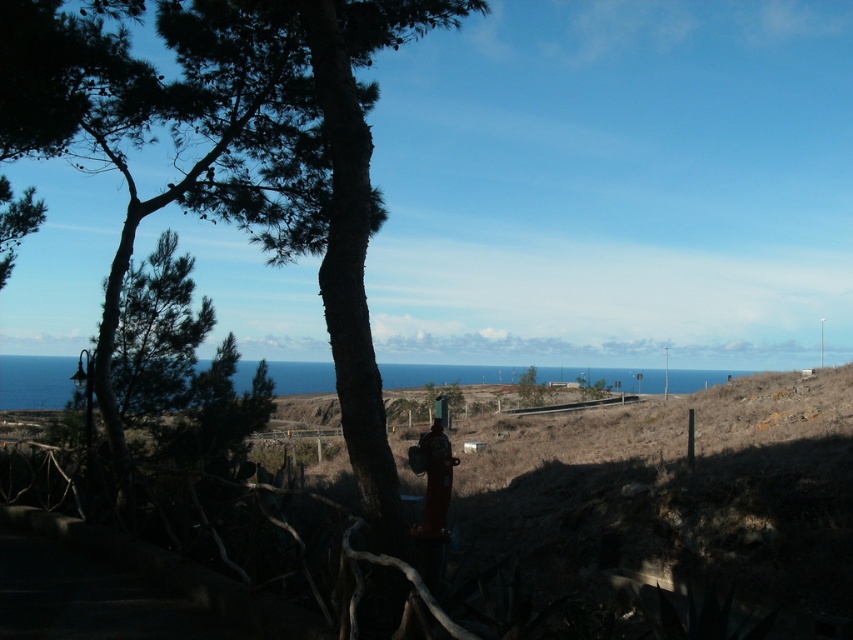
Can you confirm if matte brown jacket at center is taller than green leafy tree at center?

Yes, matte brown jacket at center is taller than green leafy tree at center.

Is matte brown jacket at center bigger than green leafy tree at center?

Yes, matte brown jacket at center is bigger than green leafy tree at center.

Is point (434, 456) positioned after point (537, 401)?

No, it is not.

Where is `matte brown jacket at center`? matte brown jacket at center is located at coordinates (433, 477).

Does blue water at center have a smaller size compared to matte brown jacket at center?

Actually, blue water at center might be larger than matte brown jacket at center.

The height and width of the screenshot is (640, 853). What are the coordinates of `blue water at center` in the screenshot? It's located at (35, 381).

Locate an element on the screen. blue water at center is located at coordinates (35, 381).

Who is higher up, blue water at center or green leafy tree at center?

Positioned higher is blue water at center.

Between point (670, 394) and point (537, 376), which one is positioned in front?

Positioned in front is point (670, 394).

You are a GUI agent. You are given a task and a screenshot of the screen. Output one action in this format:
    pyautogui.click(x=<x>, y=<y>)
    Task: Click on the blue water at center
    The height and width of the screenshot is (640, 853).
    Given the screenshot: What is the action you would take?
    pyautogui.click(x=35, y=381)